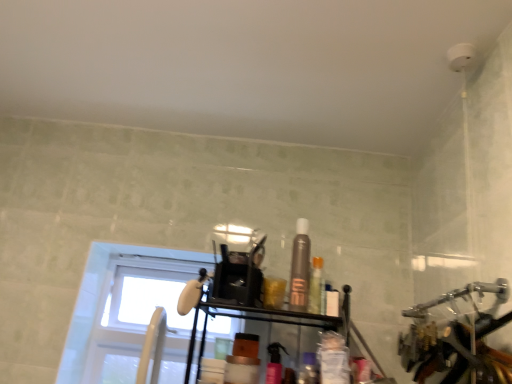
The width and height of the screenshot is (512, 384). Find the location of `translucent plastic container at center, which is the 3th toiletry in left-to-right order`. translucent plastic container at center, which is the 3th toiletry in left-to-right order is located at coordinates (308, 369).

The width and height of the screenshot is (512, 384). What do you see at coordinates (308, 369) in the screenshot? I see `translucent plastic container at center, the 2th toiletry viewed from the right` at bounding box center [308, 369].

What do you see at coordinates (316, 287) in the screenshot?
I see `translucent plastic bottle at center, the 4th toiletry viewed from the left` at bounding box center [316, 287].

At what (x,y) coordinates should I click in order to perform the action: click on pink glossy spray can at center, the fourth toiletry when ordered from right to left. Please return your answer as a coordinate pair (x, y). The width and height of the screenshot is (512, 384). Looking at the image, I should click on (274, 363).

Locate an element on the screen. This screenshot has height=384, width=512. white glass window at upper left is located at coordinates (99, 299).

This screenshot has width=512, height=384. In order to click on translucent plastic container at center, which is the 3th toiletry in left-to-right order in this screenshot , I will do `click(308, 369)`.

Is pink glossy spray can at center, the fourth toiletry when ordered from right to left, looking in the opposite direction of white glass window at upper left?

No, pink glossy spray can at center, the fourth toiletry when ordered from right to left, is not facing the opposite direction of white glass window at upper left.

Can you confirm if pink glossy spray can at center, the fourth toiletry when ordered from right to left, is thinner than white glass window at upper left?

Yes.

Considering the points (269, 368) and (88, 297), which point is behind, point (269, 368) or point (88, 297)?

Point (88, 297)

Based on the photo, choose the correct answer: Is pink glossy spray can at center, the fourth toiletry when ordered from right to left, inside white glass window at upper left or outside it?

pink glossy spray can at center, the fourth toiletry when ordered from right to left, is outside white glass window at upper left.

Does pink glossy spray can at center, which ranks as the first toiletry in left-to-right order, have a greater height compared to satin brown spray can at center, the 2th toiletry in the left-to-right sequence?

No.

Considering the sizes of objects pink glossy spray can at center, the fourth toiletry when ordered from right to left, and satin brown spray can at center, the 2th toiletry in the left-to-right sequence, in the image provided, who is thinner, pink glossy spray can at center, the fourth toiletry when ordered from right to left, or satin brown spray can at center, the 2th toiletry in the left-to-right sequence,?

With smaller width is satin brown spray can at center, the 2th toiletry in the left-to-right sequence.

Where is `toiletry that is the 2nd object directly below the satin brown spray can at center, the third toiletry positioned from the right (from a real-world perspective)`? The width and height of the screenshot is (512, 384). toiletry that is the 2nd object directly below the satin brown spray can at center, the third toiletry positioned from the right (from a real-world perspective) is located at coordinates (274, 363).

Is pink glossy spray can at center, the fourth toiletry when ordered from right to left, facing away from satin brown spray can at center, the 2th toiletry in the left-to-right sequence?

No, satin brown spray can at center, the 2th toiletry in the left-to-right sequence, is not at the back of pink glossy spray can at center, the fourth toiletry when ordered from right to left.

Which object is more forward, translucent plastic container at center, the 2th toiletry viewed from the right, or pink glossy spray can at center, which ranks as the first toiletry in left-to-right order?

pink glossy spray can at center, which ranks as the first toiletry in left-to-right order, is closer to the camera.

Which point is more forward, (305, 365) or (275, 377)?

The point (275, 377) is closer to the camera.

Is translucent plastic container at center, the 2th toiletry viewed from the right, beside pink glossy spray can at center, which ranks as the first toiletry in left-to-right order?

Yes, translucent plastic container at center, the 2th toiletry viewed from the right, is touching pink glossy spray can at center, which ranks as the first toiletry in left-to-right order.

Considering the relative sizes of translucent plastic container at center, which is the 3th toiletry in left-to-right order, and pink glossy spray can at center, the fourth toiletry when ordered from right to left, in the image provided, is translucent plastic container at center, which is the 3th toiletry in left-to-right order, smaller than pink glossy spray can at center, the fourth toiletry when ordered from right to left,?

No, translucent plastic container at center, which is the 3th toiletry in left-to-right order, is not smaller than pink glossy spray can at center, the fourth toiletry when ordered from right to left.

From a real-world perspective, is pink glossy spray can at center, which ranks as the first toiletry in left-to-right order, positioned above or below translucent plastic container at center, which is the 3th toiletry in left-to-right order?

pink glossy spray can at center, which ranks as the first toiletry in left-to-right order, is above translucent plastic container at center, which is the 3th toiletry in left-to-right order.

Is pink glossy spray can at center, the fourth toiletry when ordered from right to left, in front of or behind translucent plastic container at center, which is the 3th toiletry in left-to-right order, in the image?

pink glossy spray can at center, the fourth toiletry when ordered from right to left, is in front of translucent plastic container at center, which is the 3th toiletry in left-to-right order.

From the image's perspective, is pink glossy spray can at center, which ranks as the first toiletry in left-to-right order, positioned above or below translucent plastic container at center, the 2th toiletry viewed from the right?

Based on their image positions, pink glossy spray can at center, which ranks as the first toiletry in left-to-right order, is located above translucent plastic container at center, the 2th toiletry viewed from the right.

Where is `the 1st toiletry above when counting from the translucent plastic container at center, the 2th toiletry viewed from the right (from the image's perspective)`? Image resolution: width=512 pixels, height=384 pixels. the 1st toiletry above when counting from the translucent plastic container at center, the 2th toiletry viewed from the right (from the image's perspective) is located at coordinates (274, 363).

Which is in front, white glass window at upper left or pink glossy spray can at center, the fourth toiletry when ordered from right to left?

pink glossy spray can at center, the fourth toiletry when ordered from right to left, is closer to the camera.

Find the location of `the 1st toiletry counting from the right side of the white glass window at upper left`. the 1st toiletry counting from the right side of the white glass window at upper left is located at coordinates (274, 363).

In the scene shown: Which object is positioned more to the left, white glass window at upper left or pink glossy spray can at center, which ranks as the first toiletry in left-to-right order?

white glass window at upper left.

Based on the photo, what's the angular difference between white glass window at upper left and pink glossy spray can at center, the fourth toiletry when ordered from right to left,'s facing directions?

The facing directions of white glass window at upper left and pink glossy spray can at center, the fourth toiletry when ordered from right to left, are 8.14 degrees apart.

Does white glass window at upper left turn towards translucent plastic bottle at center, the 4th toiletry viewed from the left?

No, white glass window at upper left is not aimed at translucent plastic bottle at center, the 4th toiletry viewed from the left.

Is translucent plastic bottle at center, which appears as the first toiletry when viewed from the right, completely or partially inside white glass window at upper left?

No, translucent plastic bottle at center, which appears as the first toiletry when viewed from the right, is located outside of white glass window at upper left.

Is white glass window at upper left closer to camera compared to translucent plastic bottle at center, which appears as the first toiletry when viewed from the right?

No.

From a real-world perspective, who is located lower, white glass window at upper left or translucent plastic bottle at center, the 4th toiletry viewed from the left?

white glass window at upper left is physically lower.

Between white glass window at upper left and translucent plastic container at center, the 2th toiletry viewed from the right, which one has larger width?

Wider between the two is white glass window at upper left.

Who is shorter, white glass window at upper left or translucent plastic container at center, the 2th toiletry viewed from the right?

With less height is translucent plastic container at center, the 2th toiletry viewed from the right.

From the image's perspective, is white glass window at upper left located above or below translucent plastic container at center, which is the 3th toiletry in left-to-right order?

white glass window at upper left is below translucent plastic container at center, which is the 3th toiletry in left-to-right order.

Which of these two, white glass window at upper left or translucent plastic container at center, the 2th toiletry viewed from the right, is smaller?

With smaller size is translucent plastic container at center, the 2th toiletry viewed from the right.

You are a GUI agent. You are given a task and a screenshot of the screen. Output one action in this format:
    pyautogui.click(x=<x>, y=<y>)
    Task: Click on the 4th toiletry in front when counting from the white glass window at upper left
    The width and height of the screenshot is (512, 384).
    Given the screenshot: What is the action you would take?
    pyautogui.click(x=274, y=363)

From a real-world perspective, which toiletry is the 2nd one underneath the satin brown spray can at center, the 2th toiletry in the left-to-right sequence? Please provide its 2D coordinates.

[(274, 363)]

From the image, which object appears to be farther from white glass window at upper left, satin brown spray can at center, the 2th toiletry in the left-to-right sequence, or pink glossy spray can at center, the fourth toiletry when ordered from right to left?

Based on the image, pink glossy spray can at center, the fourth toiletry when ordered from right to left, appears to be further to white glass window at upper left.

Estimate the real-world distances between objects in this image. Which object is closer to satin brown spray can at center, the third toiletry positioned from the right, translucent plastic container at center, the 2th toiletry viewed from the right, or translucent plastic bottle at center, the 4th toiletry viewed from the left?

translucent plastic bottle at center, the 4th toiletry viewed from the left.

In the scene shown: When comparing their distances from pink glossy spray can at center, the fourth toiletry when ordered from right to left, does translucent plastic container at center, which is the 3th toiletry in left-to-right order, or satin brown spray can at center, the third toiletry positioned from the right, seem further?

→ Among the two, satin brown spray can at center, the third toiletry positioned from the right, is located further to pink glossy spray can at center, the fourth toiletry when ordered from right to left.

Which object lies nearer to the anchor point pink glossy spray can at center, the fourth toiletry when ordered from right to left, satin brown spray can at center, the 2th toiletry in the left-to-right sequence, or translucent plastic bottle at center, the 4th toiletry viewed from the left?

translucent plastic bottle at center, the 4th toiletry viewed from the left, is closer to pink glossy spray can at center, the fourth toiletry when ordered from right to left.

Looking at the image, which one is located closer to translucent plastic container at center, which is the 3th toiletry in left-to-right order, satin brown spray can at center, the 2th toiletry in the left-to-right sequence, or white glass window at upper left?

satin brown spray can at center, the 2th toiletry in the left-to-right sequence, lies closer to translucent plastic container at center, which is the 3th toiletry in left-to-right order, than the other object.

Based on their spatial positions, is pink glossy spray can at center, the fourth toiletry when ordered from right to left, or translucent plastic bottle at center, the 4th toiletry viewed from the left, closer to satin brown spray can at center, the 2th toiletry in the left-to-right sequence?

The object closer to satin brown spray can at center, the 2th toiletry in the left-to-right sequence, is translucent plastic bottle at center, the 4th toiletry viewed from the left.

Based on their spatial positions, is pink glossy spray can at center, which ranks as the first toiletry in left-to-right order, or satin brown spray can at center, the 2th toiletry in the left-to-right sequence, closer to translucent plastic container at center, which is the 3th toiletry in left-to-right order?

pink glossy spray can at center, which ranks as the first toiletry in left-to-right order, is positioned closer to the anchor translucent plastic container at center, which is the 3th toiletry in left-to-right order.

When comparing their distances from white glass window at upper left, does satin brown spray can at center, the 2th toiletry in the left-to-right sequence, or translucent plastic bottle at center, which appears as the first toiletry when viewed from the right, seem further?

translucent plastic bottle at center, which appears as the first toiletry when viewed from the right, lies further to white glass window at upper left than the other object.

Image resolution: width=512 pixels, height=384 pixels. Find the location of `toiletry between white glass window at upper left and satin brown spray can at center, the third toiletry positioned from the right`. toiletry between white glass window at upper left and satin brown spray can at center, the third toiletry positioned from the right is located at coordinates (274, 363).

You are a GUI agent. You are given a task and a screenshot of the screen. Output one action in this format:
    pyautogui.click(x=<x>, y=<y>)
    Task: Click on the toiletry between translucent plastic bottle at center, the 4th toiletry viewed from the left, and translucent plastic container at center, the 2th toiletry viewed from the right, from top to bottom
    The image size is (512, 384).
    Given the screenshot: What is the action you would take?
    pyautogui.click(x=274, y=363)

Image resolution: width=512 pixels, height=384 pixels. What are the coordinates of `toiletry between satin brown spray can at center, the third toiletry positioned from the right, and pink glossy spray can at center, the fourth toiletry when ordered from right to left, vertically` in the screenshot? It's located at (316, 287).